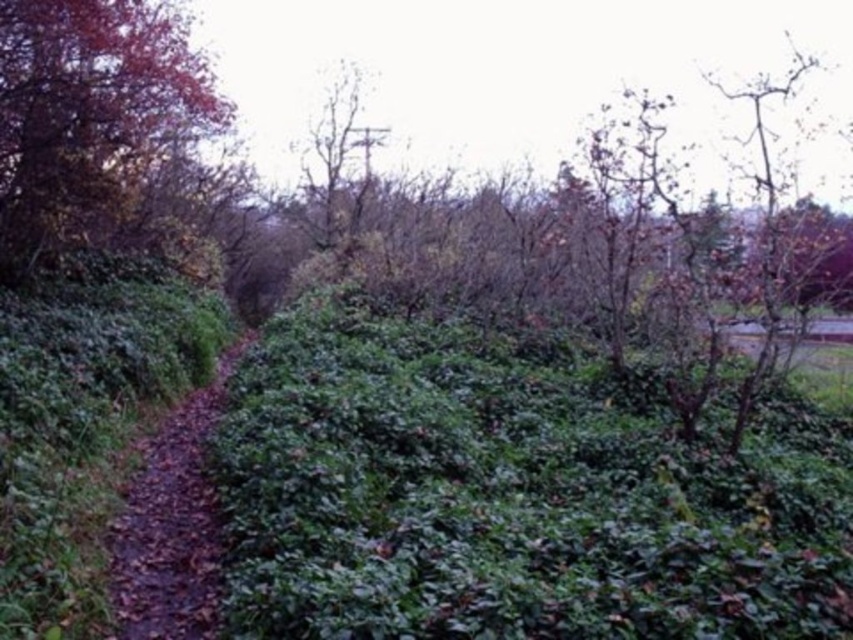
Looking at this image, who is positioned more to the left, green leafy hedge at center or shiny red leaves at upper left?

shiny red leaves at upper left is more to the left.

Who is more forward, [436,320] or [85,193]?

Point [85,193]

Is point (469, 529) positioned behind point (32, 42)?

No.

Where is `green leafy hedge at center`? green leafy hedge at center is located at coordinates (511, 492).

Does brown dirt path at center have a lesser height compared to bare wood tree at center?

No.

Is brown dirt path at center above bare wood tree at center?

Incorrect, brown dirt path at center is not positioned above bare wood tree at center.

Which is behind, point (140, 467) or point (326, 228)?

The point (326, 228) is more distant.

Where is `brown dirt path at center`? brown dirt path at center is located at coordinates (171, 524).

Is green leafy hedge at center to the left of brown dirt path at center from the viewer's perspective?

Incorrect, green leafy hedge at center is not on the left side of brown dirt path at center.

Which is behind, point (344, 445) or point (186, 481)?

The point (186, 481) is more distant.

The width and height of the screenshot is (853, 640). What do you see at coordinates (511, 492) in the screenshot?
I see `green leafy hedge at center` at bounding box center [511, 492].

This screenshot has height=640, width=853. I want to click on green leafy hedge at center, so click(x=511, y=492).